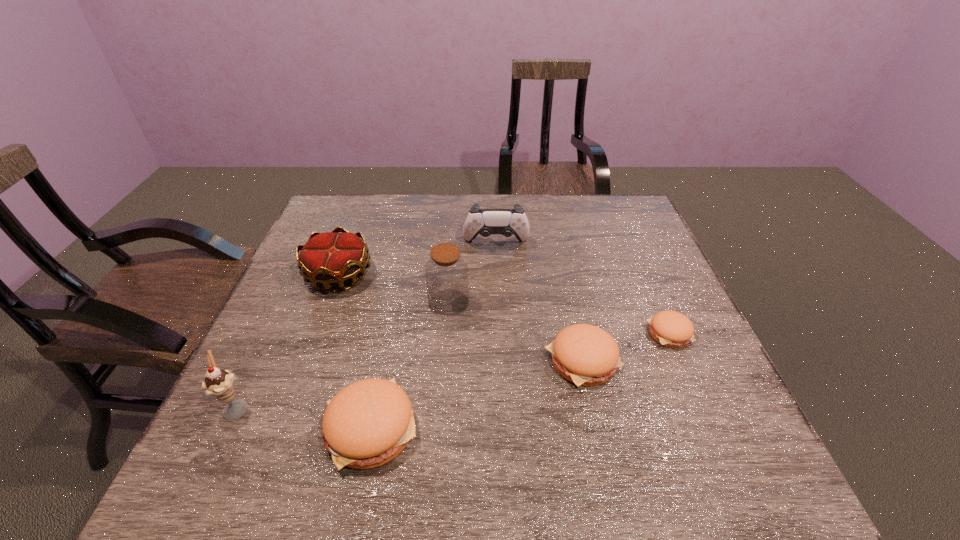
Identify which object is the second closest to the rightmost object. Please provide its 2D coordinates. Your answer should be formatted as a tuple, i.e. [(x, y)], where the tuple contains the x and y coordinates of a point satisfying the conditions above.

[(485, 222)]

Find the location of a particular element. Image resolution: width=960 pixels, height=540 pixels. object that stands as the sixth closest to the leftmost patty is located at coordinates (672, 329).

Find the location of a particular element. The height and width of the screenshot is (540, 960). the second closest patty relative to the fourth tallest object is located at coordinates (584, 354).

Point out which patty is positioned as the second nearest to the crown. Please provide its 2D coordinates. Your answer should be formatted as a tuple, i.e. [(x, y)], where the tuple contains the x and y coordinates of a point satisfying the conditions above.

[(584, 354)]

Where is `free point that satisfies the following two spatial constraints: 1. on the back side of the jar; 2. on the right side of the leftmost patty`? This screenshot has height=540, width=960. free point that satisfies the following two spatial constraints: 1. on the back side of the jar; 2. on the right side of the leftmost patty is located at coordinates (396, 303).

At what (x,y) coordinates should I click in order to perform the action: click on vacant space that satisfies the following two spatial constraints: 1. on the front side of the sixth tallest object; 2. on the right side of the jar. Please return your answer as a coordinate pair (x, y). Looking at the image, I should click on (444, 361).

The height and width of the screenshot is (540, 960). What are the coordinates of `vacant area that satisfies the following two spatial constraints: 1. on the back side of the leftmost patty; 2. on the left side of the jar` in the screenshot? It's located at (396, 303).